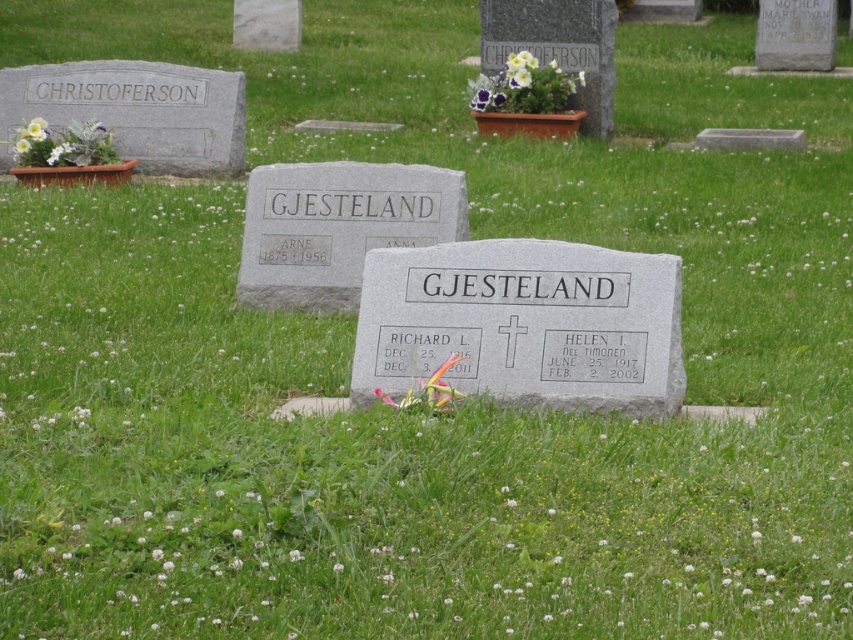
Question: Is gray granite gravestone at center smaller than purple fabric flower at upper center?

Choices:
 (A) yes
 (B) no

Answer: (A)

Question: Which object is the closest to the purple fabric flower at upper center?

Choices:
 (A) gray polished stone gravestone at center
 (B) gray granite gravestone at center

Answer: (B)

Question: Is gray granite gravestone at center above purple fabric flower at upper center?

Choices:
 (A) no
 (B) yes

Answer: (A)

Question: Which object is farther from the camera taking this photo?

Choices:
 (A) gray granite gravestone at center
 (B) purple fabric flower at upper center

Answer: (B)

Question: Which point is farther from the camera taking this photo?

Choices:
 (A) (428, 332)
 (B) (549, 84)

Answer: (B)

Question: Considering the relative positions of gray granite gravestone at center and purple fabric flower at upper center in the image provided, where is gray granite gravestone at center located with respect to purple fabric flower at upper center?

Choices:
 (A) right
 (B) left

Answer: (B)